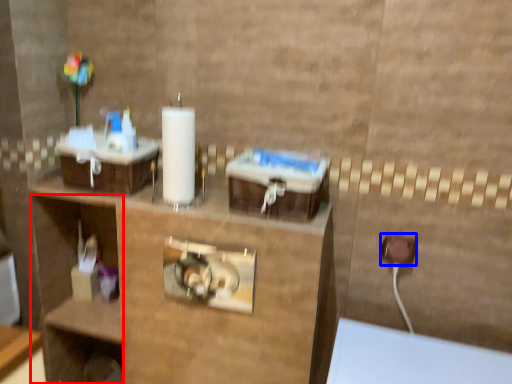
Question: Which point is closer to the camera, shelf (highlighted by a red box) or electric outlet (highlighted by a blue box)?

Choices:
 (A) shelf
 (B) electric outlet

Answer: (B)